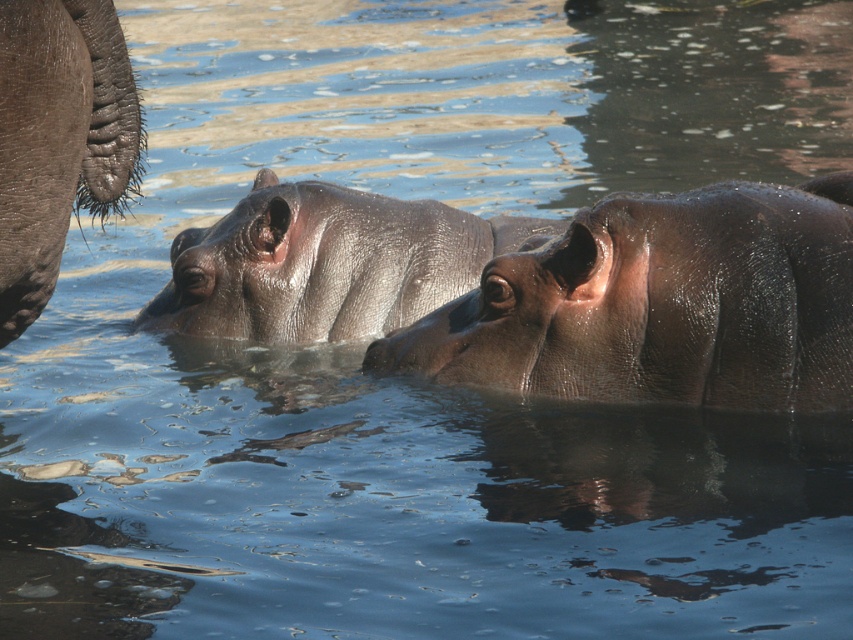
Question: Which point is closer to the camera taking this photo?

Choices:
 (A) (438, 248)
 (B) (91, 67)

Answer: (B)

Question: Is shiny brown hippo at center positioned at the back of gray textured skin at left?

Choices:
 (A) no
 (B) yes

Answer: (B)

Question: Is shiny brown hippo at center positioned at the back of slick gray hippo at center?

Choices:
 (A) yes
 (B) no

Answer: (B)

Question: Is shiny brown hippo at center closer to camera compared to gray textured skin at left?

Choices:
 (A) no
 (B) yes

Answer: (A)

Question: Among these objects, which one is farthest from the camera?

Choices:
 (A) shiny brown hippo at center
 (B) slick gray hippo at center
 (C) gray textured skin at left

Answer: (B)

Question: Which of the following is the farthest from the observer?

Choices:
 (A) tap(207, 228)
 (B) tap(741, 300)

Answer: (A)